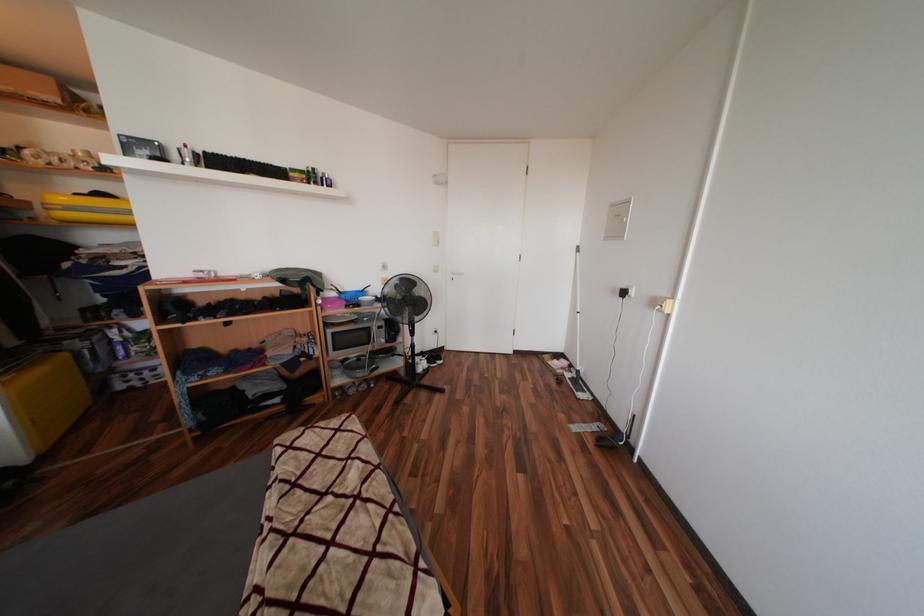
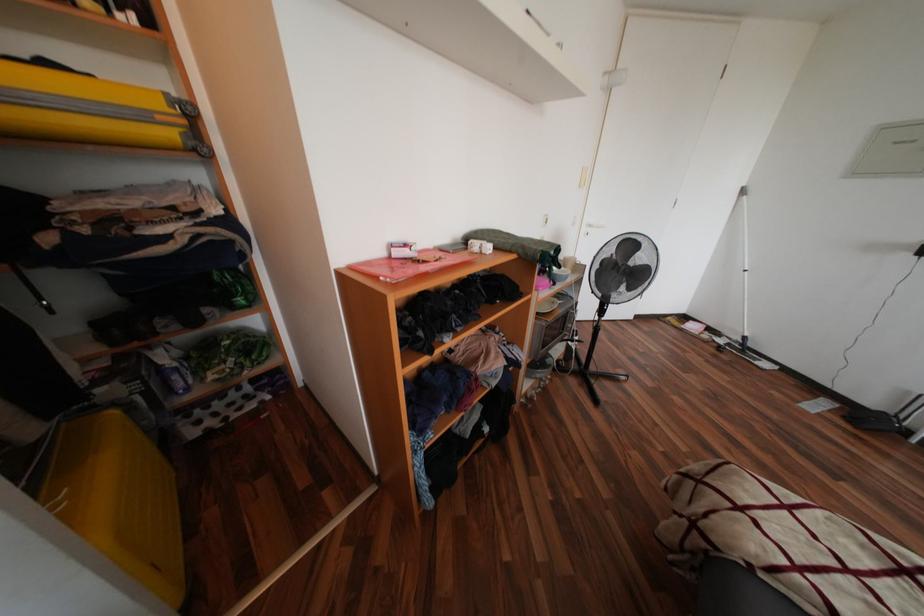
Looking at this image, the images are taken continuously from a first-person perspective. In which direction are you moving?

The movement direction of the cameraman is left, forward.